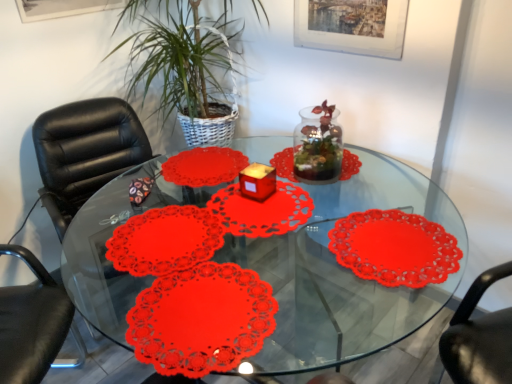
Find the location of a particular element. The height and width of the screenshot is (384, 512). vacant space to the right of matte red candle holder at center is located at coordinates (289, 195).